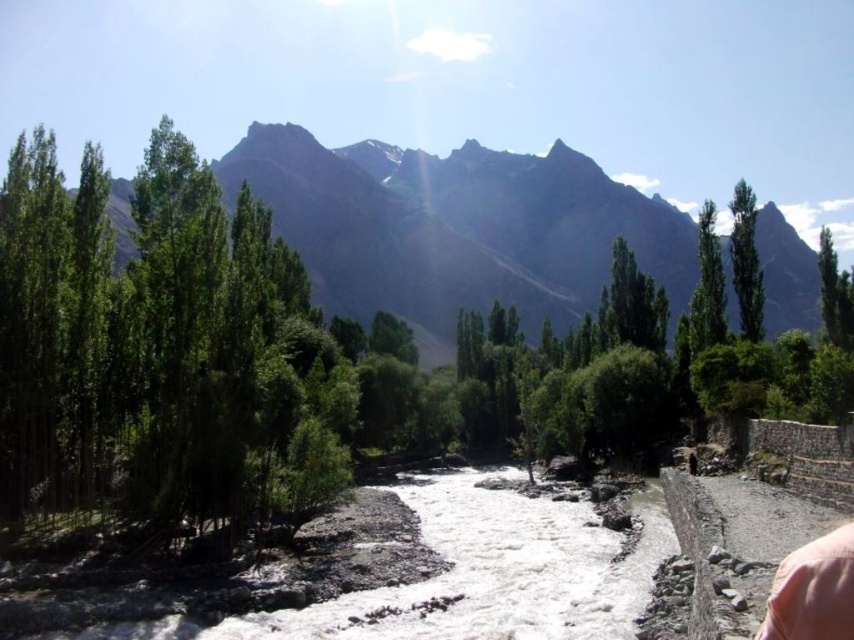
Question: Which point is farther to the camera?

Choices:
 (A) pink fabric at lower right
 (B) green leafy tree at upper right

Answer: (B)

Question: Can you confirm if green leafy trees at upper center is positioned to the left of pink fabric at lower right?

Choices:
 (A) yes
 (B) no

Answer: (B)

Question: Does green leafy trees at upper center appear over pink fabric at lower right?

Choices:
 (A) yes
 (B) no

Answer: (A)

Question: Which of the following is the farthest from the observer?

Choices:
 (A) green leafy tree at upper right
 (B) pink fabric at lower right

Answer: (A)

Question: Can you confirm if pink fabric at lower right is thinner than green leafy tree at upper right?

Choices:
 (A) no
 (B) yes

Answer: (A)

Question: Among these objects, which one is farthest from the camera?

Choices:
 (A) white rocky creek at center
 (B) green leafy trees at upper center
 (C) pink fabric at lower right

Answer: (B)